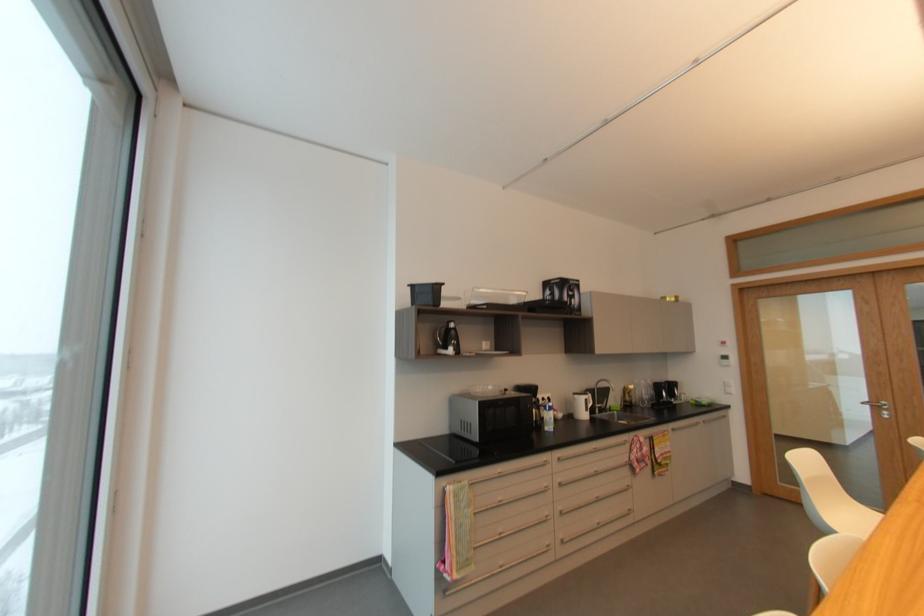
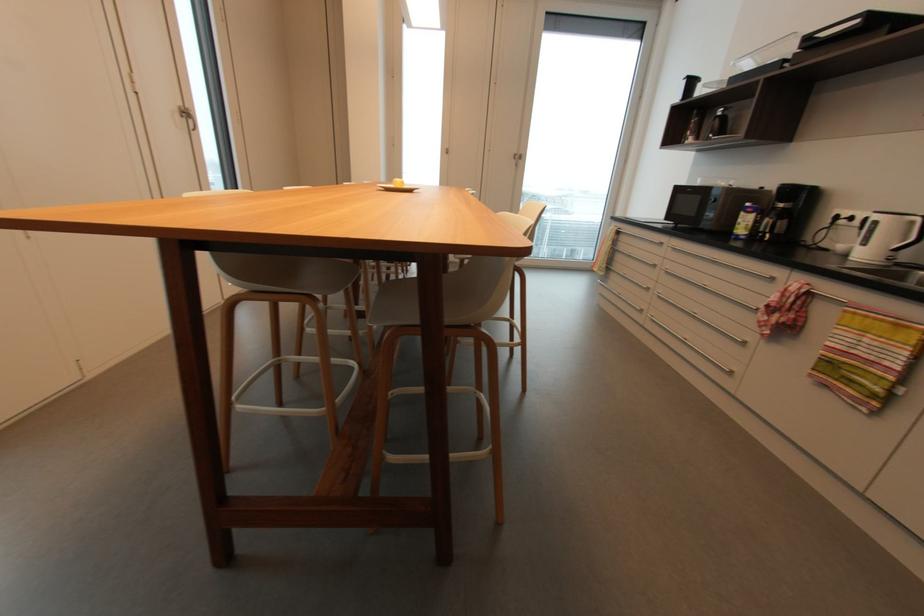
The point at (627,443) is marked in the first image. Where is the corresponding point in the second image?

(775, 280)